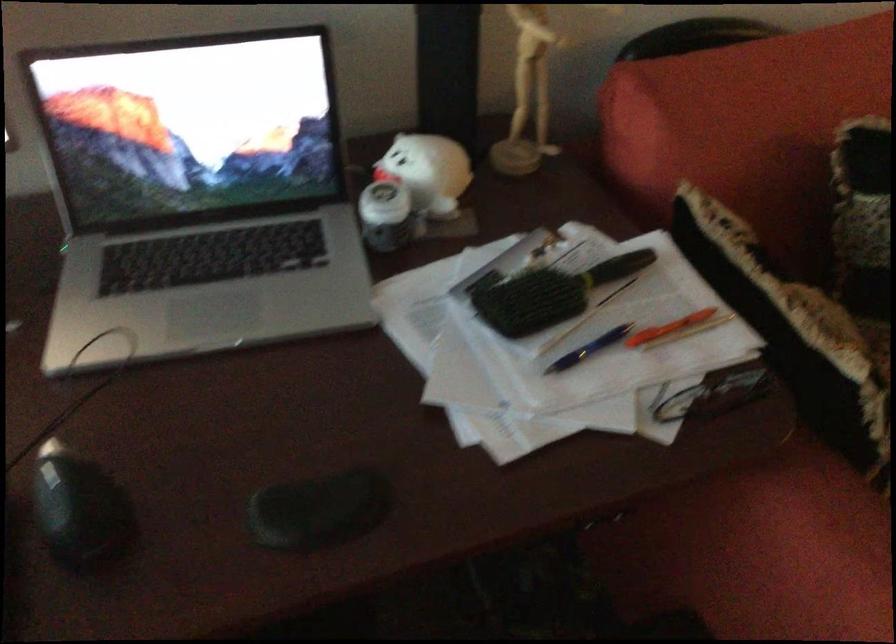
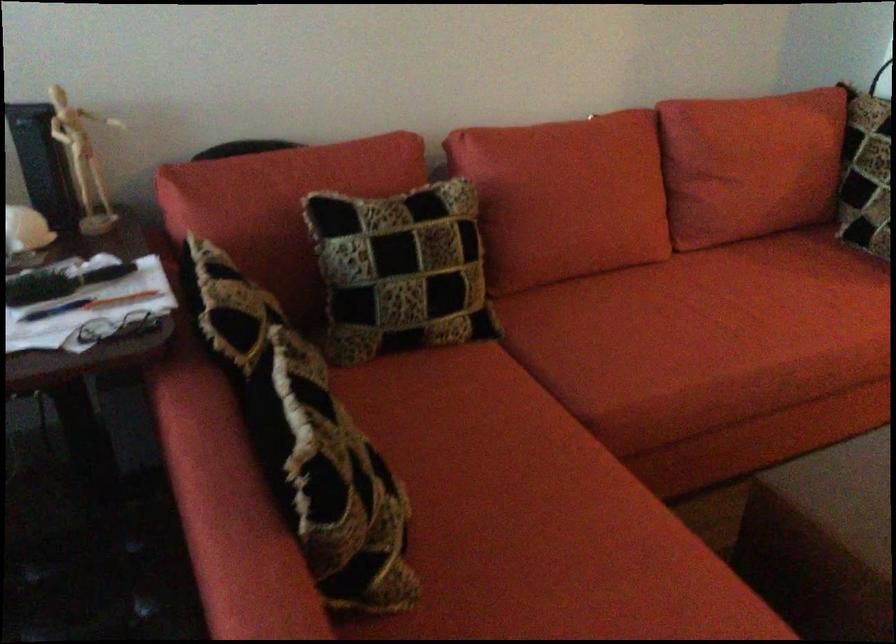
Find the pixel in the second image that matches [573,327] in the first image.

(55, 310)